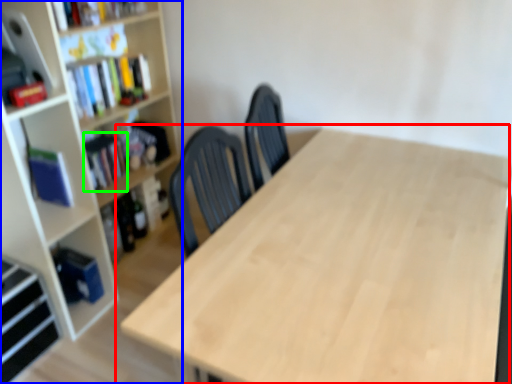
Question: Estimate the real-world distances between objects in this image. Which object is closer to table (highlighted by a red box), bookcase (highlighted by a blue box) or book (highlighted by a green box)?

Choices:
 (A) bookcase
 (B) book

Answer: (A)